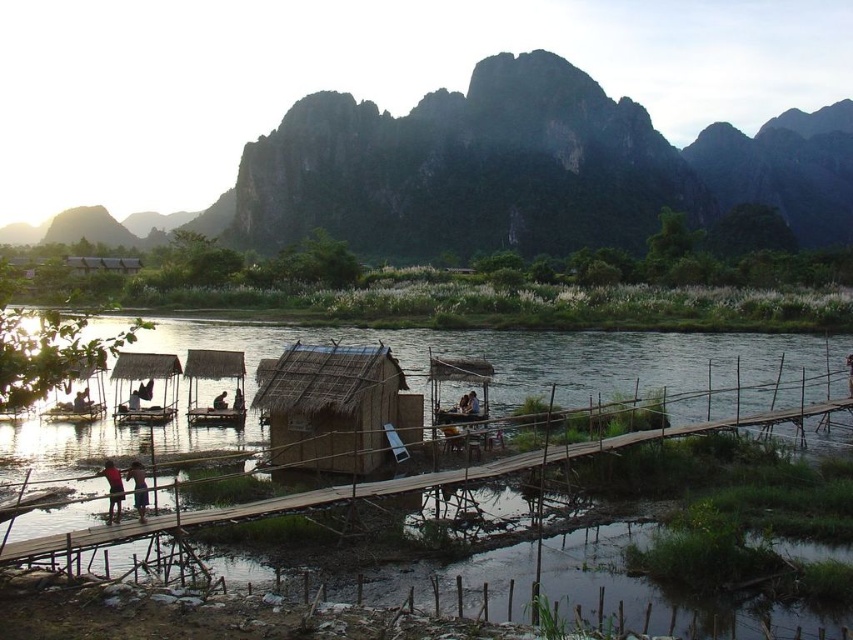
Question: Is the position of dark brown wooden stick at center less distant than that of brown wooden hut at center?

Choices:
 (A) no
 (B) yes

Answer: (B)

Question: Does brown thatch hut at center have a lesser width compared to brown wooden hut at center?

Choices:
 (A) yes
 (B) no

Answer: (B)

Question: Which object appears farthest from the camera in this image?

Choices:
 (A) dark brown wooden stick at center
 (B) brown thatch hut at center
 (C) wooden bridge at center

Answer: (B)

Question: Which point appears farthest from the camera in this image?

Choices:
 (A) (115, 506)
 (B) (305, 397)
 (C) (241, 406)
 (D) (97, 538)

Answer: (C)

Question: Can you confirm if dark brown wooden stick at center is positioned below dark brown wooden boat at center?

Choices:
 (A) no
 (B) yes

Answer: (B)

Question: Which object appears farthest from the camera in this image?

Choices:
 (A) dark brown wooden boat at center
 (B) rugged rock mountain at upper center
 (C) wooden bridge at center
 (D) dark brown wooden stick at center

Answer: (B)